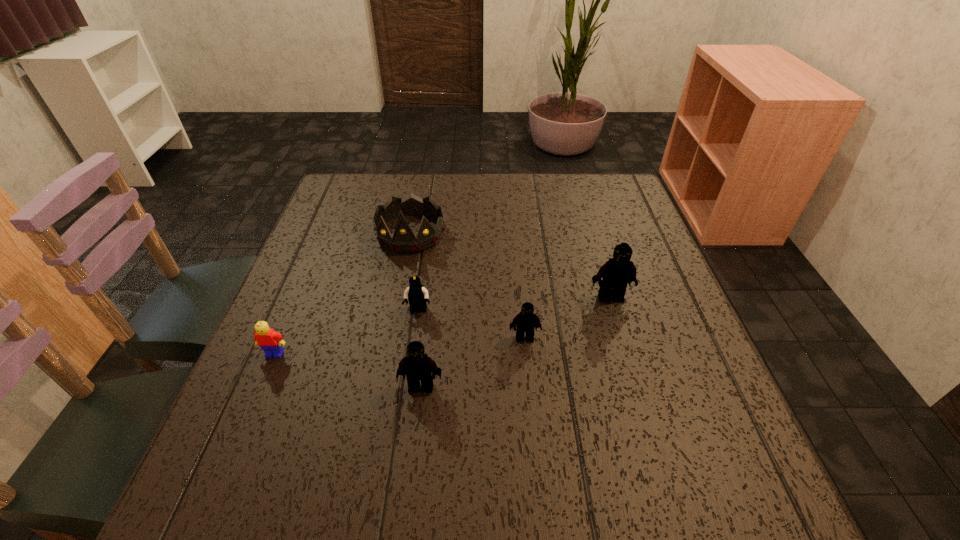
I want to click on the nearest Lego, so click(419, 366).

Find the location of `the nearest object`. the nearest object is located at coordinates (419, 366).

Where is `the third nearest Lego`? The image size is (960, 540). the third nearest Lego is located at coordinates (526, 321).

In order to click on the fourth Lego from left to right in this screenshot , I will do [x=526, y=321].

Locate an element on the screen. Image resolution: width=960 pixels, height=540 pixels. the second farthest object is located at coordinates (619, 271).

Locate an element on the screen. The image size is (960, 540). the rightmost Lego is located at coordinates (619, 271).

This screenshot has height=540, width=960. Identify the location of the farthest object. (403, 241).

The height and width of the screenshot is (540, 960). Find the location of `the fifth farthest object`. the fifth farthest object is located at coordinates (270, 341).

I want to click on the leftmost Lego, so click(270, 341).

Locate an element on the screen. The height and width of the screenshot is (540, 960). the second farthest Lego is located at coordinates (417, 295).